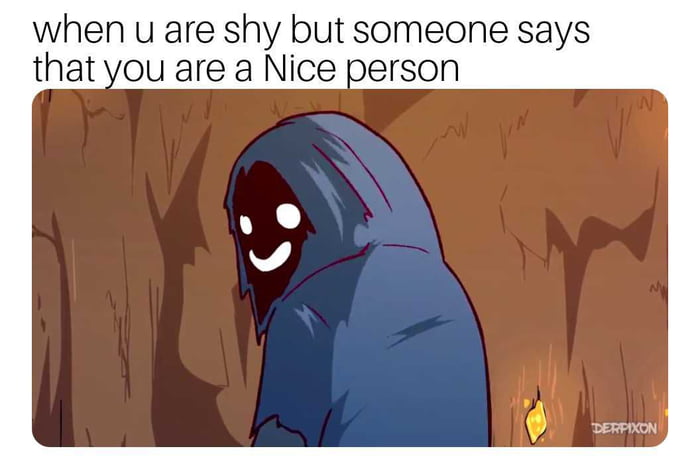
Where is `blue robe`? Image resolution: width=700 pixels, height=465 pixels. blue robe is located at coordinates (405, 294).